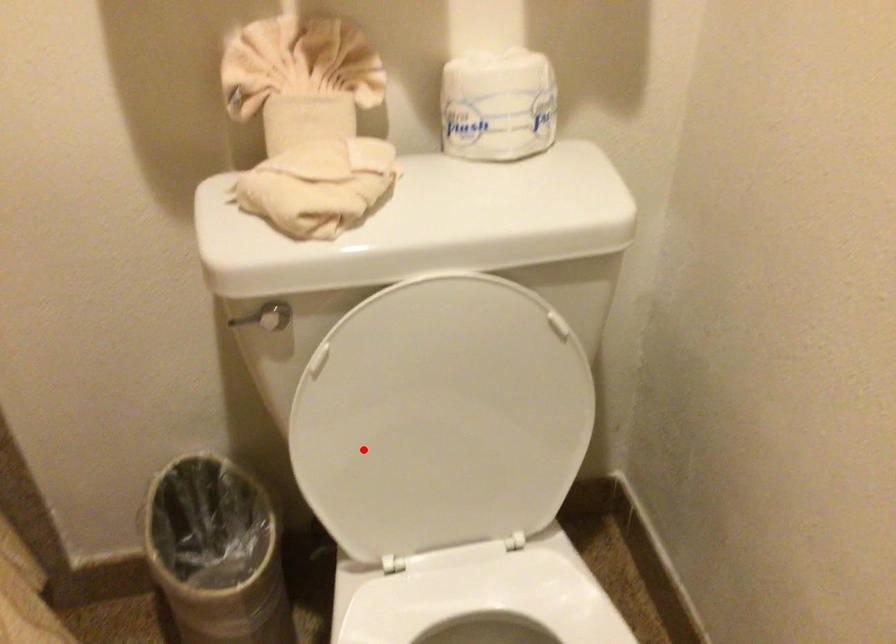
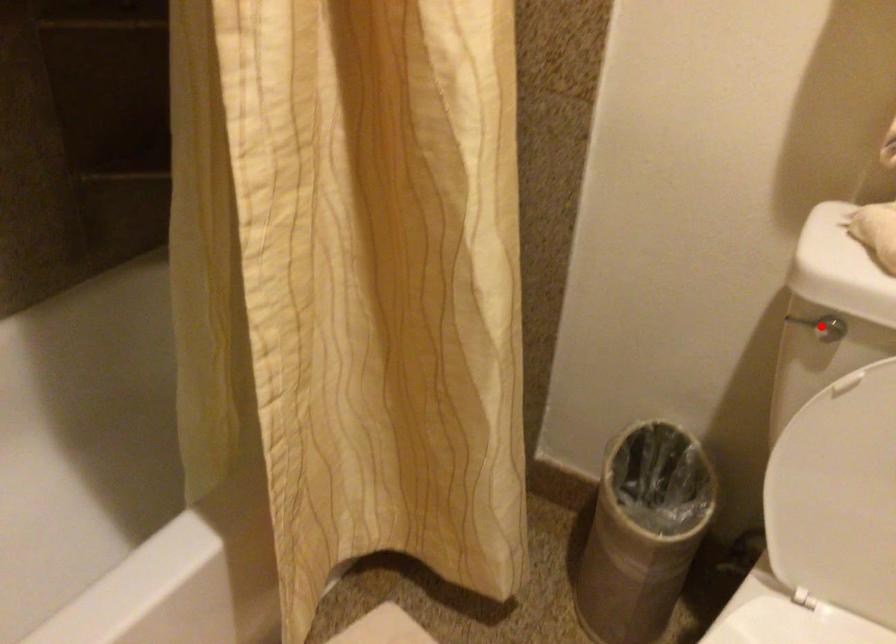
I am providing you with two images of the same scene from different viewpoints. A red point is marked on the first image and another point is marked on the second image. Do the highlighted points in image1 and image2 indicate the same real-world spot?

No